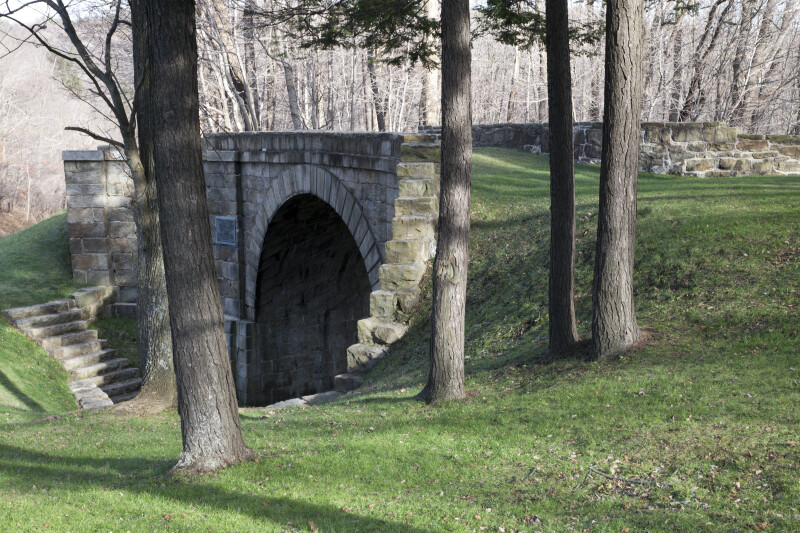
Locate an element on the screen. archway is located at coordinates (334, 189).